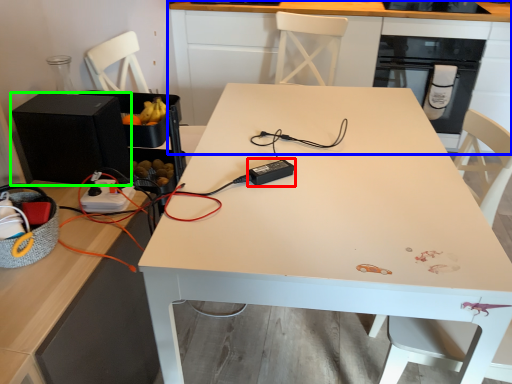
Question: Which object is positioned farthest from appliance (highlighted by a red box)? Select from cabinetry (highlighted by a blue box) and appliance (highlighted by a green box).

Choices:
 (A) cabinetry
 (B) appliance

Answer: (A)